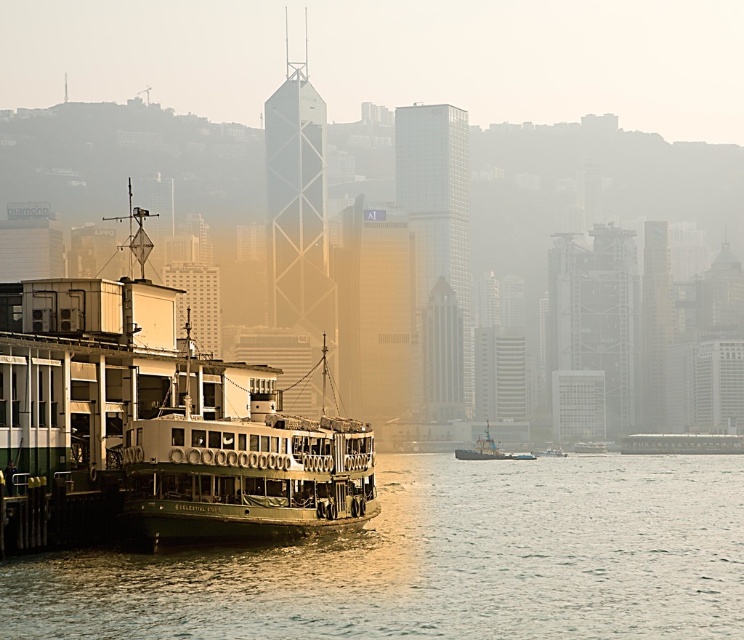
Is green matte ferry at center closer to the viewer compared to metallic gray tugboat at center?

Yes, green matte ferry at center is in front of metallic gray tugboat at center.

Can you confirm if green matte ferry at center is shorter than metallic gray tugboat at center?

No, green matte ferry at center is not shorter than metallic gray tugboat at center.

Which is behind, point (327, 492) or point (472, 451)?

The point (472, 451) is more distant.

I want to click on green matte ferry at center, so click(246, 476).

Who is shorter, smooth water at lower left or metallic gray tugboat at center?

metallic gray tugboat at center is shorter.

Between smooth water at lower left and metallic gray tugboat at center, which one is positioned lower?

metallic gray tugboat at center is lower down.

Is point (205, 596) farther from viewer compared to point (487, 452)?

No, (205, 596) is in front of (487, 452).

At what (x,y) coordinates should I click in order to perform the action: click on smooth water at lower left. Please return your answer as a coordinate pair (x, y). Image resolution: width=744 pixels, height=640 pixels. Looking at the image, I should click on (437, 563).

Does smooth water at lower left have a greater width compared to green painted wood ferry at left?

Yes.

Image resolution: width=744 pixels, height=640 pixels. Describe the element at coordinates (437, 563) in the screenshot. I see `smooth water at lower left` at that location.

Find the location of `smooth water at lower left`. smooth water at lower left is located at coordinates (437, 563).

The width and height of the screenshot is (744, 640). I want to click on smooth water at lower left, so click(x=437, y=563).